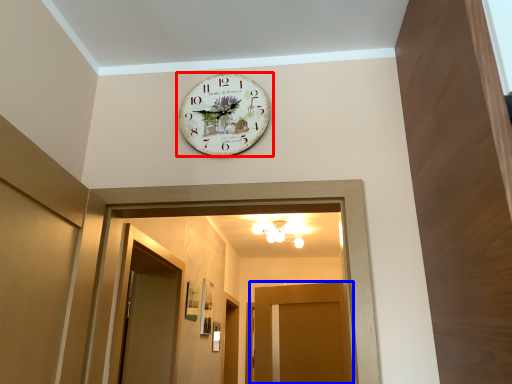
Question: Which of the following is the farthest to the observer, wall clock (highlighted by a red box) or door (highlighted by a blue box)?

Choices:
 (A) wall clock
 (B) door

Answer: (B)